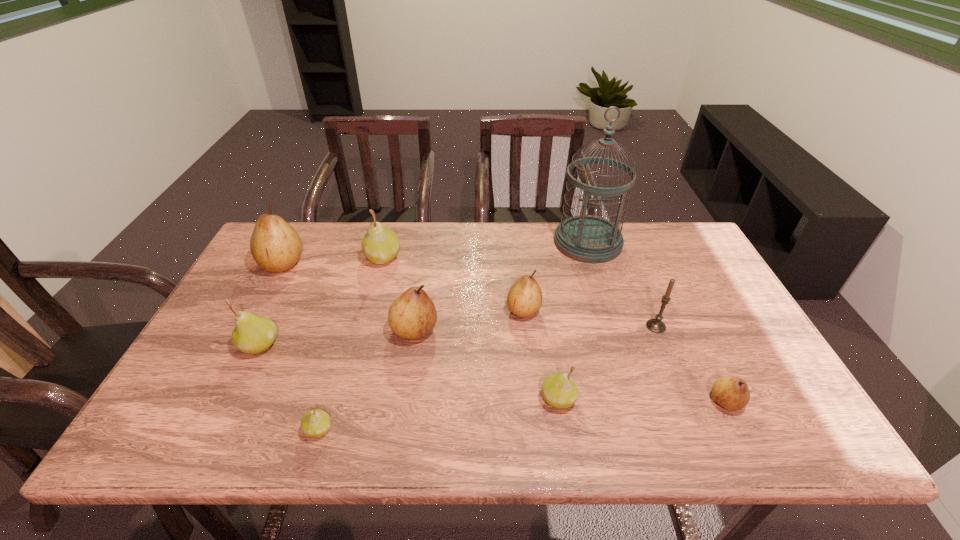
Image resolution: width=960 pixels, height=540 pixels. I want to click on the second smallest green pear, so 559,390.

Find the location of a particular element. the third farthest green pear is located at coordinates (559, 390).

This screenshot has height=540, width=960. Find the location of `the rightmost pear`. the rightmost pear is located at coordinates (732, 393).

The height and width of the screenshot is (540, 960). I want to click on the rightmost brown pear, so click(732, 393).

Where is `the nearest pear`? The width and height of the screenshot is (960, 540). the nearest pear is located at coordinates (315, 423).

Find the location of a particular element. the nearest green pear is located at coordinates (315, 423).

Locate an element on the screen. vacant space positioned on the front-facing side of the birdcage is located at coordinates (607, 304).

You are a GUI agent. You are given a task and a screenshot of the screen. Output one action in this format:
    pyautogui.click(x=<x>, y=<y>)
    Task: Click on the vacant space situated 0.180m on the right of the biggest green pear
    This screenshot has height=540, width=960.
    Given the screenshot: What is the action you would take?
    pyautogui.click(x=458, y=258)

Where is `vacant space located 0.170m on the right of the biggest brown pear`? vacant space located 0.170m on the right of the biggest brown pear is located at coordinates (360, 264).

You are a GUI agent. You are given a task and a screenshot of the screen. Output one action in this format:
    pyautogui.click(x=<x>, y=<y>)
    Task: Click on the free space located 0.220m on the left of the gray candle
    
    Given the screenshot: What is the action you would take?
    pyautogui.click(x=564, y=326)